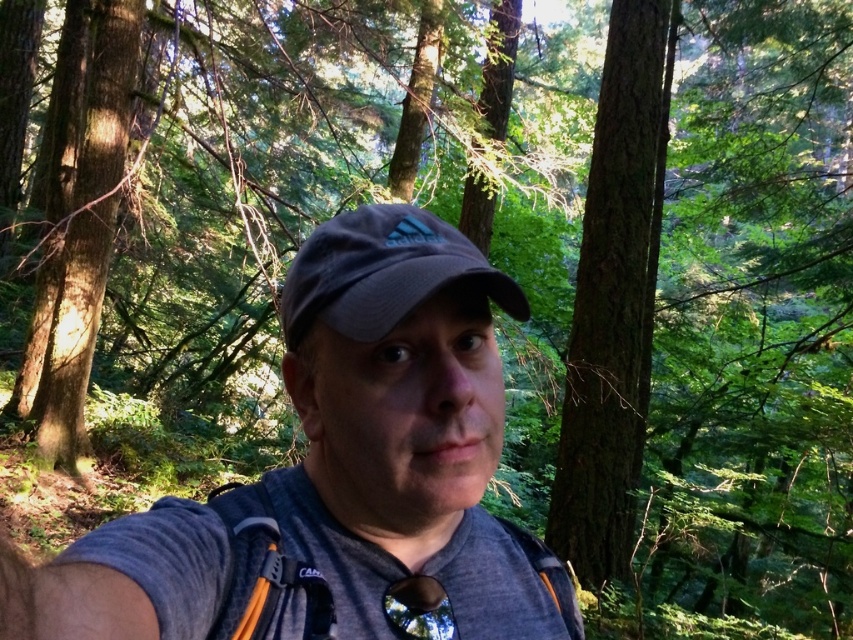
Who is positioned more to the left, gray fabric cap at center or smooth bark tree at center?

gray fabric cap at center

Describe the element at coordinates (339, 476) in the screenshot. The width and height of the screenshot is (853, 640). I see `gray fabric cap at center` at that location.

Locate an element on the screen. The height and width of the screenshot is (640, 853). gray fabric cap at center is located at coordinates (339, 476).

Based on the photo, who is more forward, (608,179) or (386,232)?

Point (386,232)

Between smooth bark tree at center and dark gray fabric cap at center, which one has more height?

Standing taller between the two is smooth bark tree at center.

Who is more distant from viewer, (605, 182) or (381, 257)?

Positioned behind is point (605, 182).

What are the coordinates of `smooth bark tree at center` in the screenshot? It's located at click(614, 298).

Can you confirm if gray fabric cap at center is thinner than dark gray fabric cap at center?

No.

Is gray fabric cap at center bigger than dark gray fabric cap at center?

Yes.

The image size is (853, 640). I want to click on gray fabric cap at center, so pos(339,476).